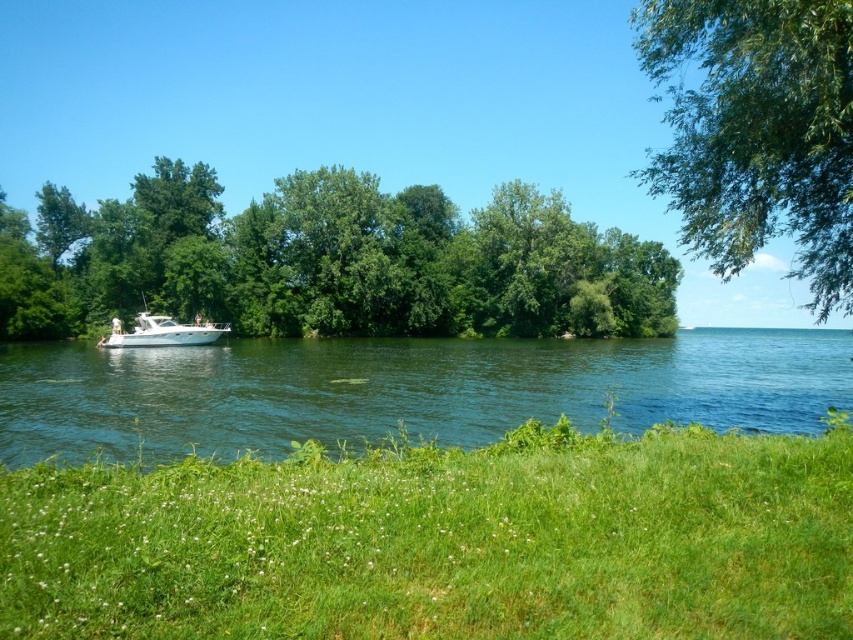
Question: Where is green grass at lower center located in relation to white glossy boat at left in the image?

Choices:
 (A) above
 (B) below

Answer: (B)

Question: Which object appears farthest from the camera in this image?

Choices:
 (A) green water at lower center
 (B) white glossy boat at left
 (C) green leafy trees at left
 (D) green grass at lower center

Answer: (C)

Question: Is green grass at lower center further to the viewer compared to green water at lower center?

Choices:
 (A) yes
 (B) no

Answer: (B)

Question: Which object is farther from the camera taking this photo?

Choices:
 (A) green leafy tree at upper right
 (B) green grass at lower center
 (C) green water at lower center

Answer: (A)

Question: Considering the relative positions of green leafy trees at left and white glossy boat at left in the image provided, where is green leafy trees at left located with respect to white glossy boat at left?

Choices:
 (A) right
 (B) left

Answer: (B)

Question: Which object is farther from the camera taking this photo?

Choices:
 (A) green leafy trees at left
 (B) green water at lower center

Answer: (A)